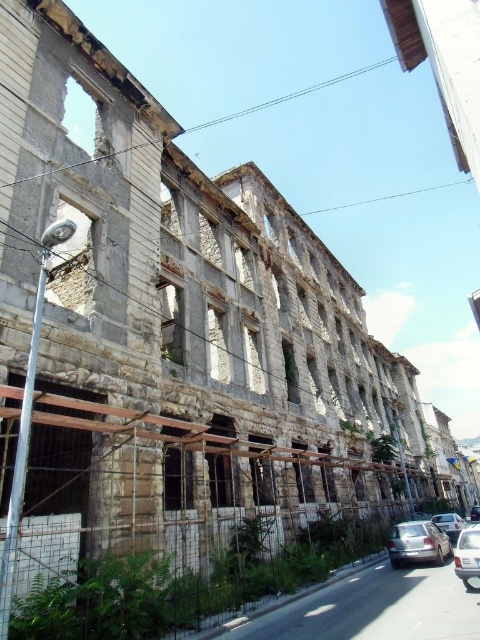
Question: Does silver metallic sedan at lower right appear on the right side of metallic silver car at lower right?

Choices:
 (A) no
 (B) yes

Answer: (A)

Question: Based on their relative distances, which object is farther from the shiny black car at center?

Choices:
 (A) silver metallic sedan at lower right
 (B) silver metallic car at lower right

Answer: (B)

Question: From the image, what is the correct spatial relationship of silver metallic sedan at lower right in relation to shiny black car at center?

Choices:
 (A) left
 (B) right

Answer: (A)

Question: Among these points, which one is farthest from the camera?

Choices:
 (A) (454, 520)
 (B) (420, 556)

Answer: (A)

Question: Is the position of metallic silver car at lower right more distant than that of shiny black car at center?

Choices:
 (A) yes
 (B) no

Answer: (B)

Question: Which of the following is the farthest from the observer?

Choices:
 (A) silver metallic car at lower right
 (B) metallic silver car at lower right
 (C) shiny black car at center
 (D) silver metallic sedan at lower right

Answer: (C)